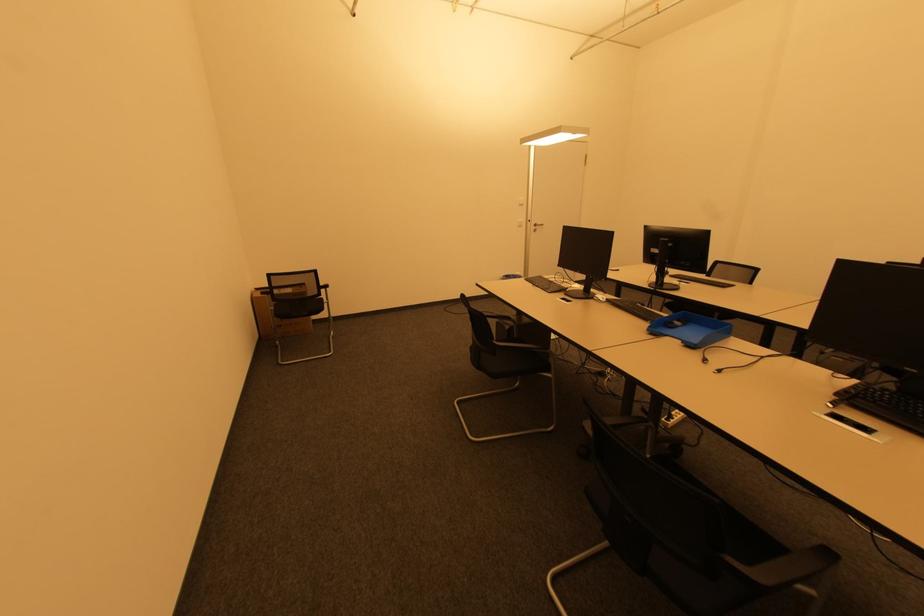
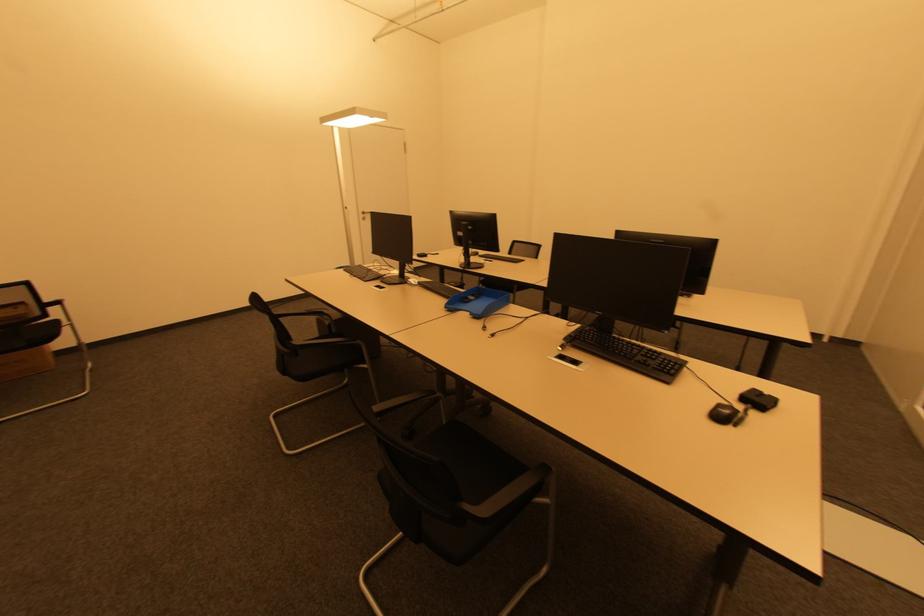
Question: The camera is either moving clockwise (left) or counter-clockwise (right) around the object. The first image is from the beginning of the video and the second image is from the end. Is the camera moving left or right when shooting the video?

Choices:
 (A) Left
 (B) Right

Answer: (A)